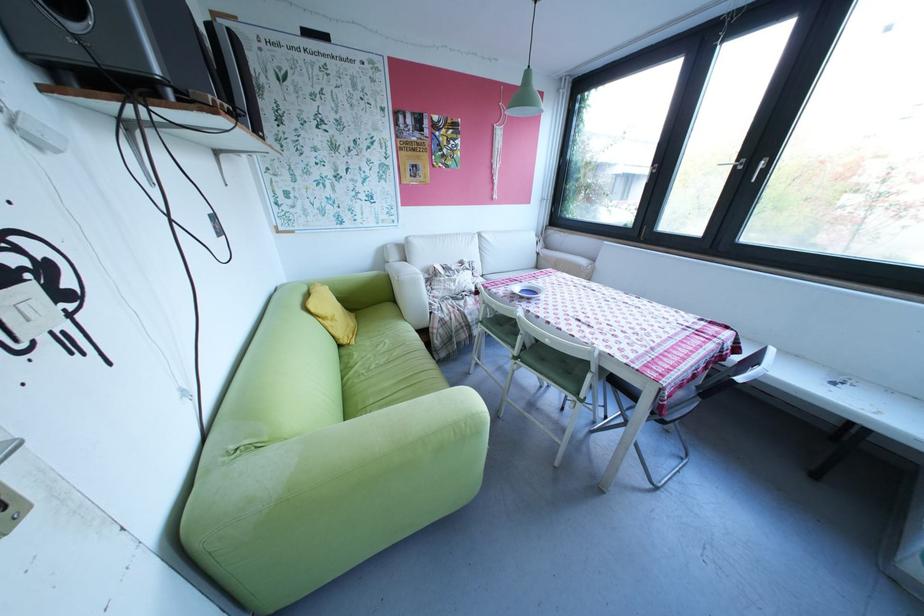
Find the location of `green sofa armrest`. green sofa armrest is located at coordinates (358, 472).